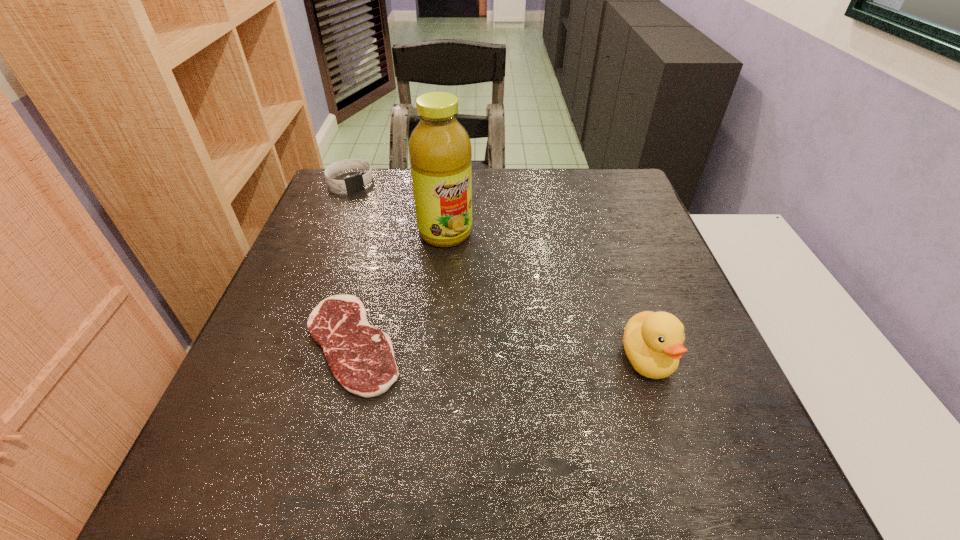
The height and width of the screenshot is (540, 960). I want to click on vacant space on the desktop that is between the shortest object and the second tallest object and is positioned on the front label of the tallest object, so click(x=534, y=353).

The height and width of the screenshot is (540, 960). In order to click on free space on the desktop that is between the shortest object and the duckling and is positioned on the outer surface of the wristband in this screenshot , I will do `click(464, 349)`.